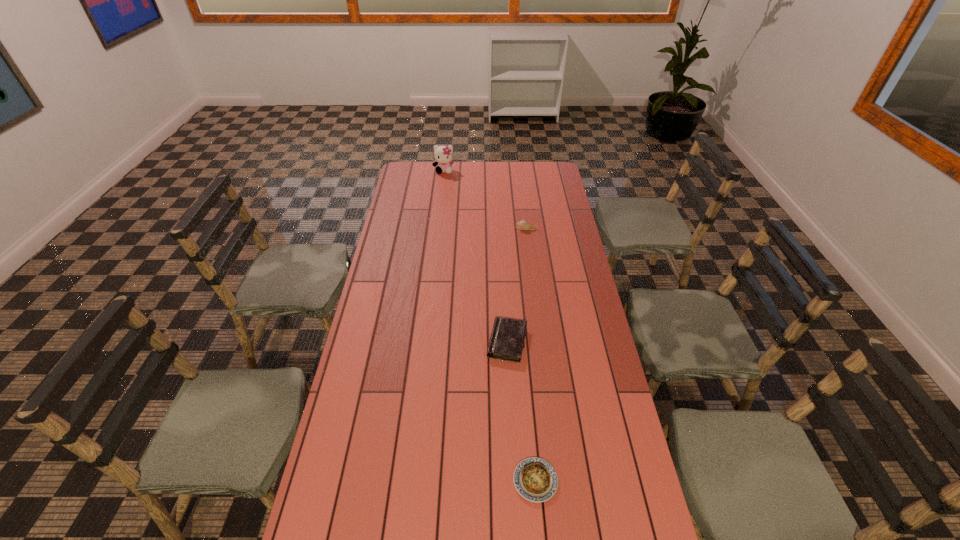
Locate an element on the screen. vacant point located between the third tallest object and the second tallest object is located at coordinates (516, 285).

At what (x,y) coordinates should I click in order to perform the action: click on empty space that is in between the quiche and the kitten. Please return your answer as a coordinate pair (x, y). This screenshot has height=540, width=960. Looking at the image, I should click on (490, 326).

You are a GUI agent. You are given a task and a screenshot of the screen. Output one action in this format:
    pyautogui.click(x=<x>, y=<y>)
    Task: Click on the vacant area that lies between the kitten and the diary
    
    Given the screenshot: What is the action you would take?
    (476, 256)

The width and height of the screenshot is (960, 540). What are the coordinates of `vacant point located between the diary and the quiche` in the screenshot? It's located at click(x=521, y=411).

Identify the location of free spot between the leftmost object and the nearest object. (490, 326).

Locate an element on the screen. free point between the tallest object and the third farthest object is located at coordinates (476, 256).

Locate an element on the screen. empty space that is in between the second nearest object and the tallest object is located at coordinates (476, 256).

Identify which object is the second nearest to the tallest object. Please provide its 2D coordinates. Your answer should be formatted as a tuple, i.e. [(x, y)], where the tuple contains the x and y coordinates of a point satisfying the conditions above.

[(507, 340)]

Locate which object ranks second in proximity to the third shortest object. Please provide its 2D coordinates. Your answer should be formatted as a tuple, i.e. [(x, y)], where the tuple contains the x and y coordinates of a point satisfying the conditions above.

[(443, 155)]

This screenshot has height=540, width=960. In order to click on vacant space that satisfies the following two spatial constraints: 1. on the front-facing side of the nearest object; 2. on the left side of the leftmost object in this screenshot , I will do `click(408, 481)`.